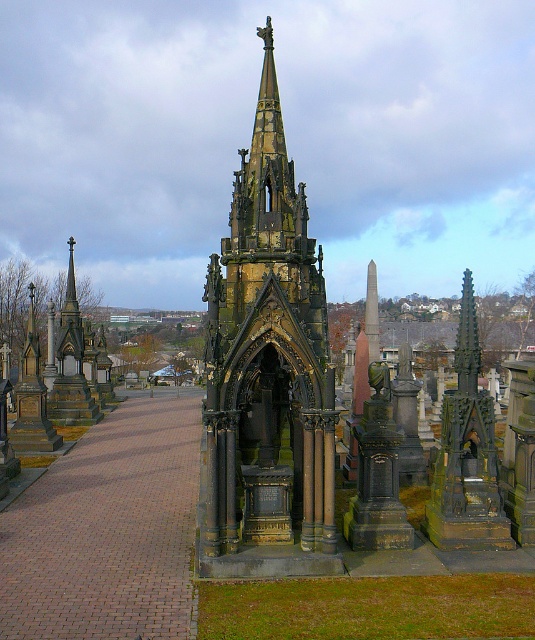
Is point (297, 221) positioned in front of point (54, 420)?

Yes, point (297, 221) is closer to viewer.

Does dark brown stone tower at center appear under dark brown stone spire at left?

Correct, dark brown stone tower at center is located below dark brown stone spire at left.

Does point (269, 401) come behind point (66, 324)?

No, (269, 401) is in front of (66, 324).

Image resolution: width=535 pixels, height=640 pixels. I want to click on dark brown stone tower at center, so click(266, 374).